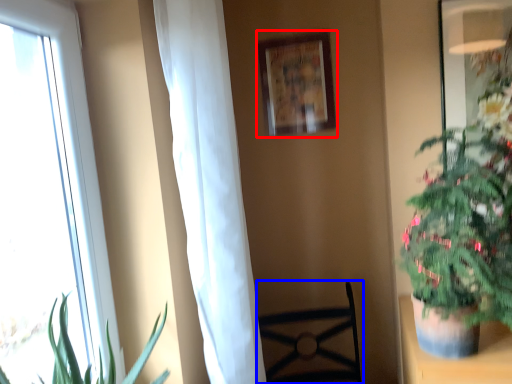
Question: Which object is further to the camera taking this photo, picture frame (highlighted by a red box) or furniture (highlighted by a blue box)?

Choices:
 (A) picture frame
 (B) furniture

Answer: (A)